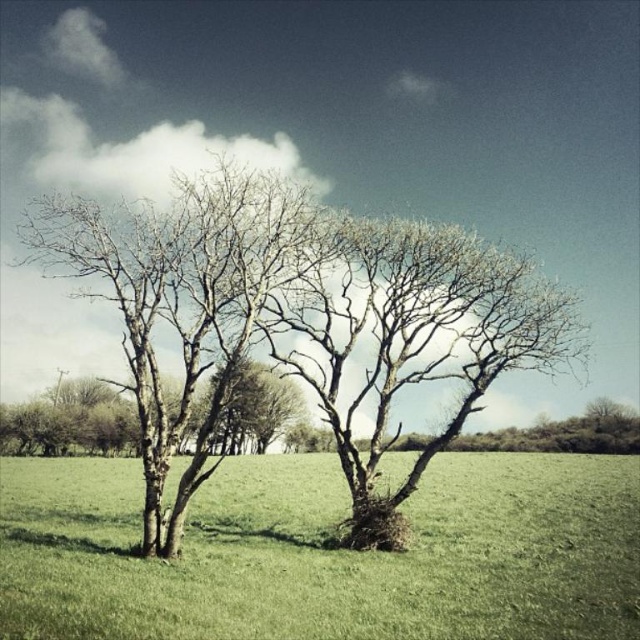
Is the position of green grass at center less distant than that of bare branches at center?

Yes, green grass at center is closer to the viewer.

What do you see at coordinates (324, 554) in the screenshot?
I see `green grass at center` at bounding box center [324, 554].

Measure the distance between point (568,515) and camera.

Point (568,515) is 106.93 feet away from camera.

This screenshot has width=640, height=640. Identify the location of green grass at center. (324, 554).

Between bare bark tree at center and bare branches at center, which one is positioned higher?

Positioned higher is bare bark tree at center.

Is point (182, 499) farther from viewer compared to point (396, 531)?

No.

Where is `bare bark tree at center`? This screenshot has height=640, width=640. bare bark tree at center is located at coordinates (182, 298).

Is green grass at center thinner than bare bark tree at center?

In fact, green grass at center might be wider than bare bark tree at center.

Identify the location of green grass at center. The width and height of the screenshot is (640, 640). (324, 554).

The width and height of the screenshot is (640, 640). In order to click on green grass at center in this screenshot , I will do `click(324, 554)`.

You are a GUI agent. You are given a task and a screenshot of the screen. Output one action in this format:
    pyautogui.click(x=<x>, y=<y>)
    Task: Click on the green grass at center
    The width and height of the screenshot is (640, 640).
    Given the screenshot: What is the action you would take?
    pyautogui.click(x=324, y=554)